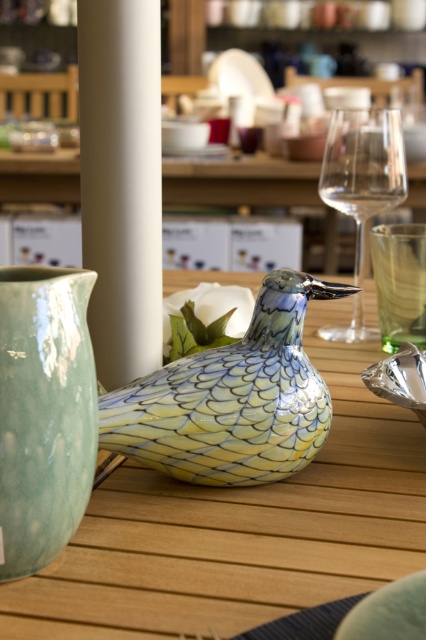
Between point (173, 497) and point (379, 240), which one is positioned in front?

Point (173, 497) is more forward.

Can you confirm if porcelain bird at center is thinner than transparent glass at center?

Incorrect, porcelain bird at center's width is not less than transparent glass at center's.

Does point (78, 580) come farther from viewer compared to point (412, 256)?

That is False.

The height and width of the screenshot is (640, 426). I want to click on porcelain bird at center, so point(241,529).

Is matte green vase at left below transparent glass wine glass at upper right?

Yes, matte green vase at left is below transparent glass wine glass at upper right.

Which is in front, point (17, 305) or point (383, 113)?

Positioned in front is point (17, 305).

You are a GUI agent. You are given a task and a screenshot of the screen. Output one action in this format:
    pyautogui.click(x=<x>, y=<y>)
    Task: Click on the matte green vase at left
    The height and width of the screenshot is (640, 426).
    Given the screenshot: What is the action you would take?
    pyautogui.click(x=43, y=412)

Which is behind, point (109, 125) or point (26, 308)?

The point (109, 125) is behind.

Based on the photo, is the position of white smooth pillar at center more distant than that of matte green vase at left?

Yes, white smooth pillar at center is behind matte green vase at left.

Which is in front, point (111, 339) or point (68, 525)?

Point (68, 525) is in front.

Where is `white smooth pillar at center`? white smooth pillar at center is located at coordinates (121, 182).